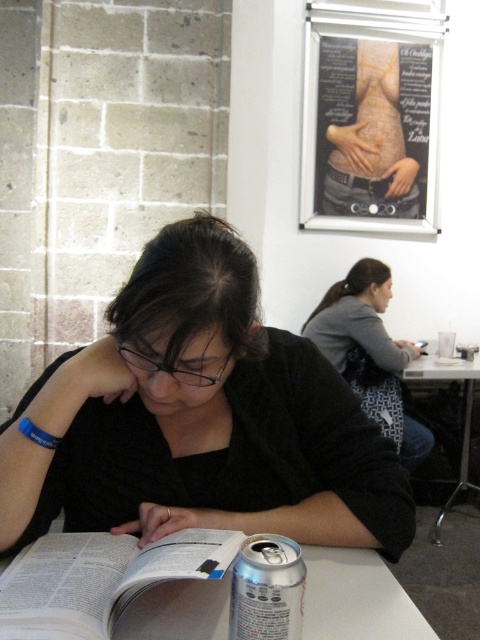
Question: Is metallic silver poster at upper center wider than paperback book at center?

Choices:
 (A) yes
 (B) no

Answer: (A)

Question: Which of the following is the closest to the observer?

Choices:
 (A) pyautogui.click(x=380, y=324)
 (B) pyautogui.click(x=130, y=605)

Answer: (B)

Question: Among these objects, which one is farthest from the camera?

Choices:
 (A) black matte book at center
 (B) gray fabric shirt at upper right

Answer: (B)

Question: Does silver metallic can at lower center have a larger size compared to metallic silver table at lower right?

Choices:
 (A) yes
 (B) no

Answer: (B)

Question: Which point is farther to the camera?

Choices:
 (A) (454, 376)
 (B) (242, 636)

Answer: (A)

Question: Observing the image, what is the correct spatial positioning of paperback book at center in reference to metallic silver table at lower right?

Choices:
 (A) above
 (B) below

Answer: (A)